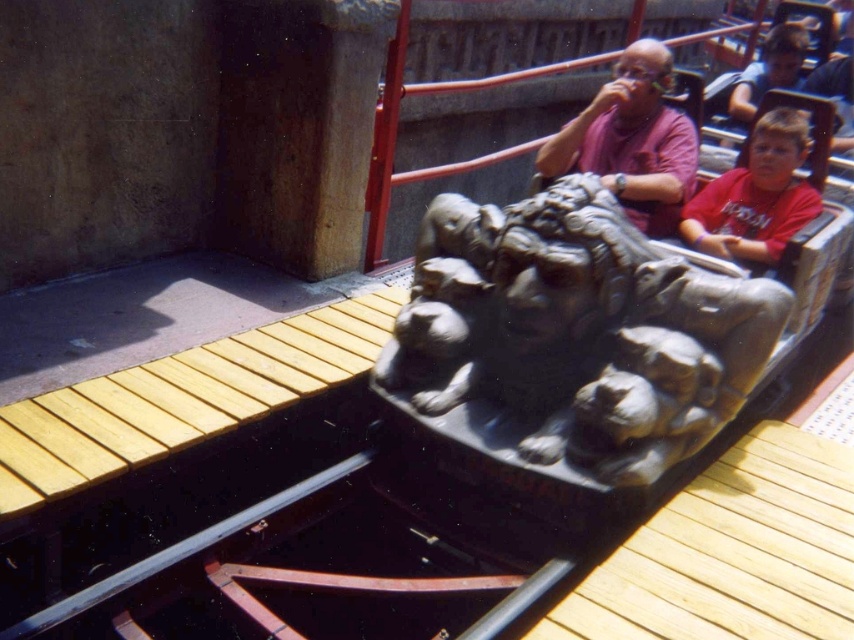
You are a photographer taking a picture of the roller coaster scene. You notice two shirts in the image, the matte purple shirt at center and the red cotton shirt at right. Which shirt should you focus on if you want to capture the larger one in your shot?

The matte purple shirt at center has a larger size compared to the red cotton shirt at right, so you should focus on the matte purple shirt at center to capture the larger one.

You are a photographer standing at the center of the roller coaster track. You notice the gray stone lion at center and the matte purple shirt at center. Which object is taller?

The gray stone lion at center is taller than the matte purple shirt at center.